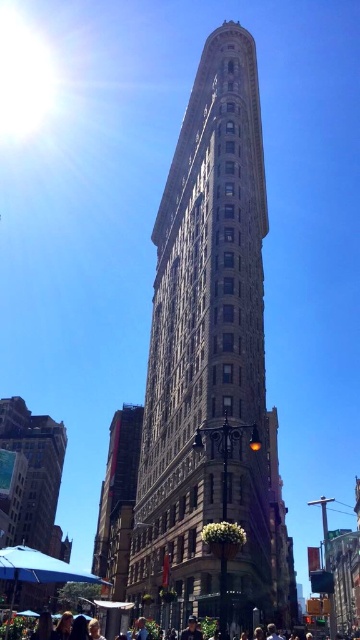
Question: Is stone textured building at center behind matte black people at lower center?

Choices:
 (A) yes
 (B) no

Answer: (A)

Question: Does stone textured building at center have a lesser width compared to matte black people at lower center?

Choices:
 (A) yes
 (B) no

Answer: (A)

Question: Among these objects, which one is nearest to the camera?

Choices:
 (A) stone textured building at center
 (B) matte black people at lower center

Answer: (B)

Question: Which object is closer to the camera taking this photo?

Choices:
 (A) matte black people at lower center
 (B) stone textured building at center

Answer: (A)

Question: Does stone textured building at center have a greater width compared to matte black people at lower center?

Choices:
 (A) no
 (B) yes

Answer: (A)